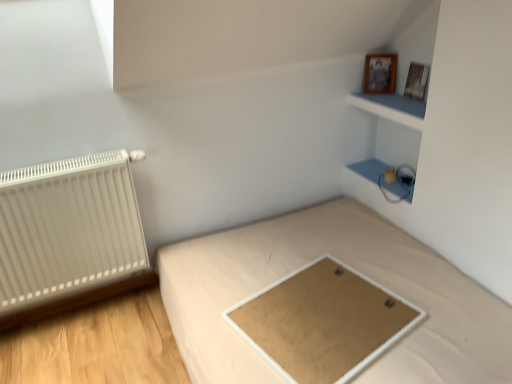
Question: Is white matte radiator at left bigger or smaller than matte white cabinet at upper right, which is counted as the first cabinet, starting from the bottom?

Choices:
 (A) small
 (B) big

Answer: (B)

Question: From a real-world perspective, is white matte radiator at left above or below matte white cabinet at upper right, which is counted as the first cabinet, starting from the bottom?

Choices:
 (A) above
 (B) below

Answer: (A)

Question: Considering the real-world distances, which object is farthest from the matte white cabinet at upper right, the second cabinet in the top-to-bottom sequence?

Choices:
 (A) wooden picture frame at upper right, which is the 1th picture frame from right to left
 (B) blue matte cabinet at upper right, which is counted as the first cabinet, starting from the top
 (C) white matte radiator at left
 (D) wooden photo frame at upper right, marked as the 1th picture frame in a left-to-right arrangement
 (E) light brown fabric bed at center

Answer: (C)

Question: Based on their relative distances, which object is nearer to the white matte radiator at left?

Choices:
 (A) light brown fabric bed at center
 (B) wooden photo frame at upper right, marked as the 2th picture frame in a right-to-left arrangement
 (C) matte white cabinet at upper right, which is counted as the first cabinet, starting from the bottom
 (D) matte brown board at center
 (E) blue matte cabinet at upper right, which is counted as the 2th cabinet, starting from the bottom

Answer: (A)